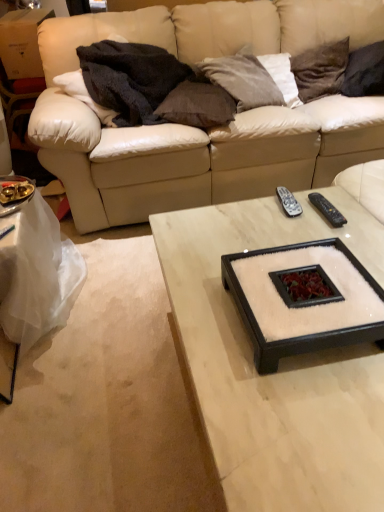
Where is `vacant area on top of white marble coffee table at center, which is counted as the first coffee table, starting from the right (from a real-world perspective)`? Image resolution: width=384 pixels, height=512 pixels. vacant area on top of white marble coffee table at center, which is counted as the first coffee table, starting from the right (from a real-world perspective) is located at coordinates point(279,241).